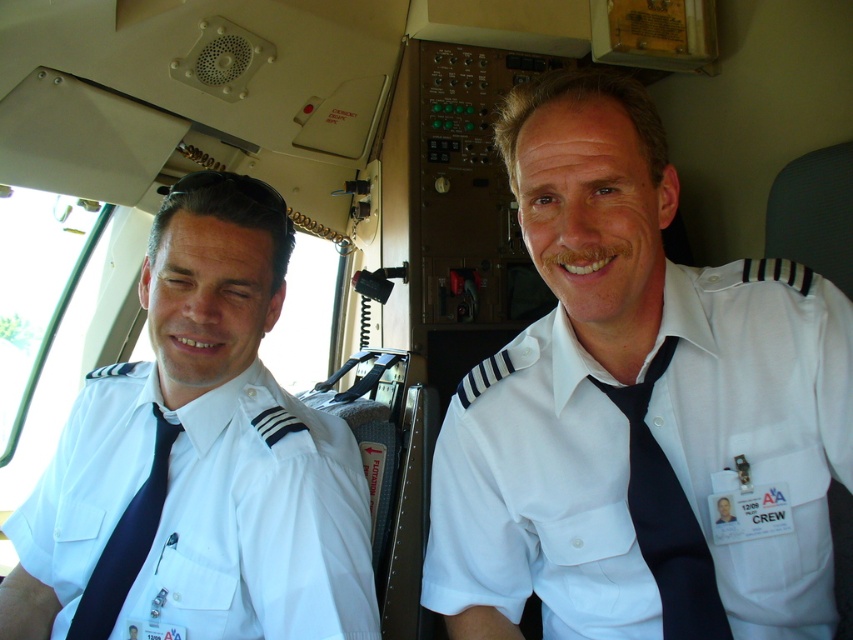
Is white cotton shirt at center positioned behind black satin tie at center?

That is False.

Does white cotton shirt at center have a lesser height compared to black satin tie at center?

No, white cotton shirt at center is not shorter than black satin tie at center.

Find the location of `white cotton shirt at center`. white cotton shirt at center is located at coordinates (758, 428).

This screenshot has width=853, height=640. I want to click on white cotton shirt at center, so click(758, 428).

Who is positioned more to the right, white cotton shirt at left or matte black tie at left?

white cotton shirt at left is more to the right.

Who is more forward, (148, 474) or (100, 588)?

Point (100, 588)

Where is `white cotton shirt at left`? white cotton shirt at left is located at coordinates (207, 513).

Does black satin tie at center come in front of matte black tie at left?

Yes, it is in front of matte black tie at left.

Between point (720, 611) and point (82, 616), which one is positioned behind?

The point (82, 616) is behind.

Who is more distant from viewer, (x=660, y=484) or (x=119, y=605)?

The point (x=119, y=605) is behind.

Locate an element on the screen. black satin tie at center is located at coordinates (666, 518).